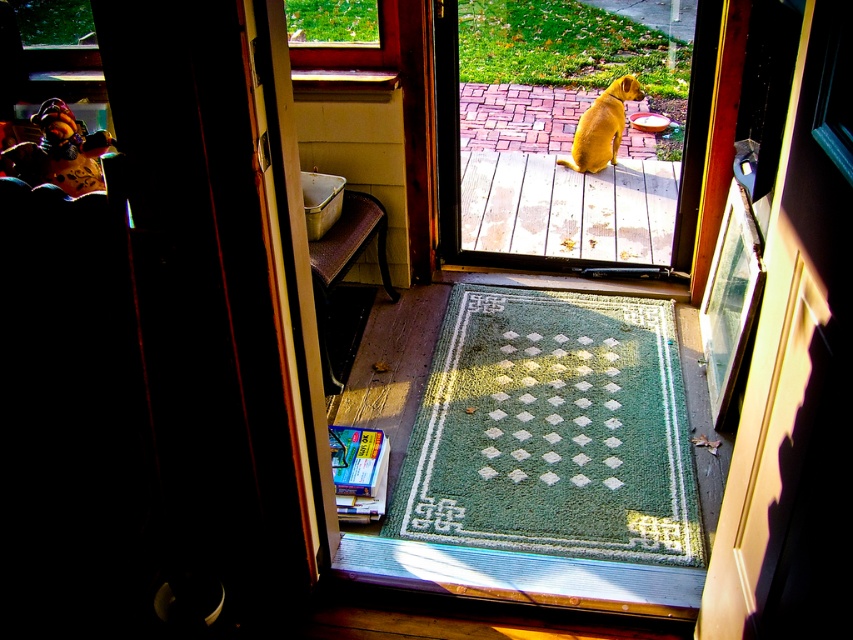
Question: Among these objects, which one is nearest to the camera?

Choices:
 (A) green textured doormat at center
 (B) golden fur dog at center
 (C) yellow fur dog at center
 (D) green woven mat at center

Answer: (D)

Question: Where is green woven mat at center located in relation to golden fur dog at center in the image?

Choices:
 (A) above
 (B) below

Answer: (B)

Question: Where is green textured doormat at center located in relation to yellow fur dog at center in the image?

Choices:
 (A) left
 (B) right

Answer: (A)

Question: Is green textured doormat at center above green woven mat at center?

Choices:
 (A) no
 (B) yes

Answer: (A)

Question: Which object is positioned farthest from the green woven mat at center?

Choices:
 (A) golden fur dog at center
 (B) yellow fur dog at center

Answer: (A)

Question: Which object is closer to the camera taking this photo?

Choices:
 (A) green woven mat at center
 (B) green textured doormat at center
 (C) golden fur dog at center

Answer: (A)